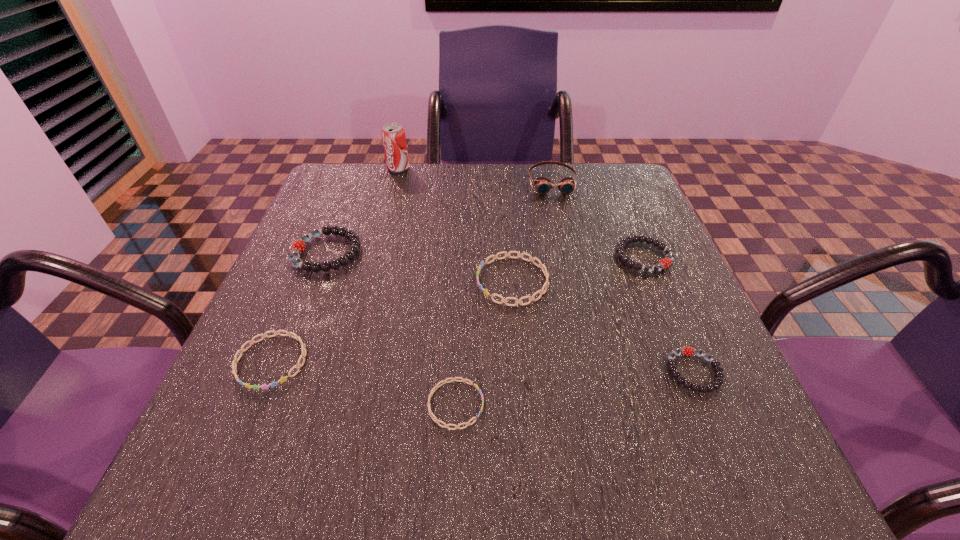
Locate an element on the screen. the tallest object is located at coordinates click(393, 135).

Identify the location of soda can. (393, 135).

At what (x,y) coordinates should I click in order to perform the action: click on the second tallest object. Please return your answer as a coordinate pair (x, y). Looking at the image, I should click on (543, 185).

This screenshot has width=960, height=540. Find the location of `the tallest bracelet`. the tallest bracelet is located at coordinates (298, 246).

Find the location of a particular element. Image resolution: width=960 pixels, height=540 pixels. the sixth shortest object is located at coordinates (298, 246).

The width and height of the screenshot is (960, 540). What are the coordinates of `the farthest blue bracelet` in the screenshot? It's located at (533, 259).

At what (x,y) coordinates should I click in order to perform the action: click on the second biggest black bracelet. Please return your answer as a coordinate pair (x, y). The image size is (960, 540). Looking at the image, I should click on (664, 263).

Locate an element on the screen. This screenshot has height=540, width=960. the second smallest blue bracelet is located at coordinates (283, 379).

This screenshot has height=540, width=960. Identify the location of the smallest black bracelet. (687, 351).

I want to click on the shortest bracelet, so click(x=431, y=414).